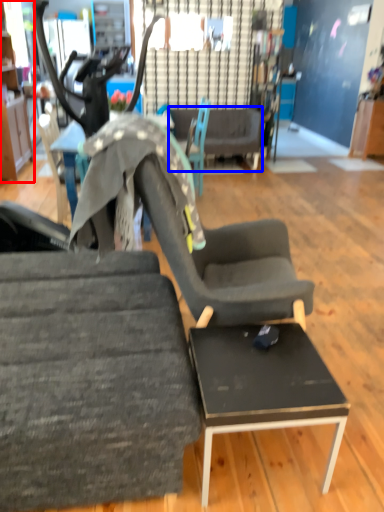
Question: Which object is further to the camera taking this photo, cabinetry (highlighted by a red box) or couch (highlighted by a blue box)?

Choices:
 (A) cabinetry
 (B) couch

Answer: (B)